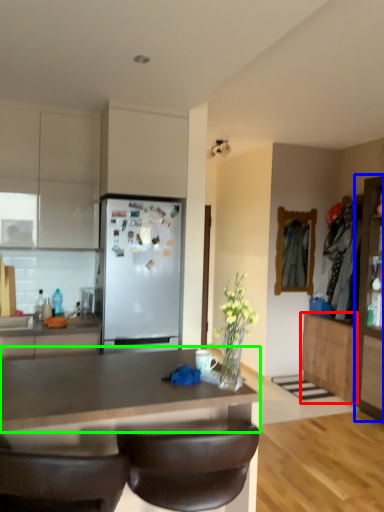
Question: Which object is positioned closest to cabinetry (highlighted by a red box)? Select from cabinetry (highlighted by a blue box) and countertop (highlighted by a green box).

Choices:
 (A) cabinetry
 (B) countertop

Answer: (A)